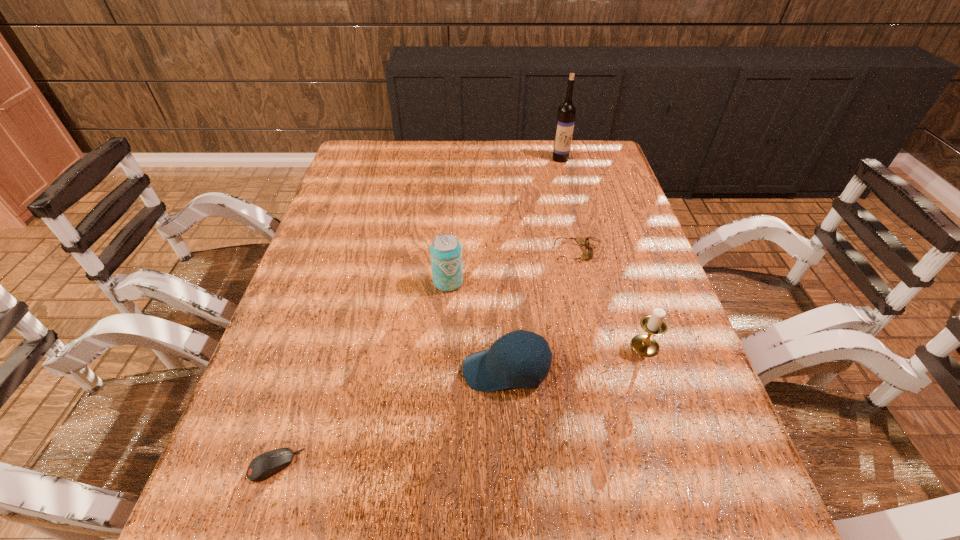
The image size is (960, 540). Find the location of `free space between the spectacles and the fourth nearest object`. free space between the spectacles and the fourth nearest object is located at coordinates (513, 267).

This screenshot has width=960, height=540. What are the coordinates of `free spot between the fourth object from right to left and the candle holder` in the screenshot? It's located at (575, 358).

The height and width of the screenshot is (540, 960). In order to click on object identified as the third closest to the spectacles in this screenshot , I will do `click(501, 367)`.

Locate which object is the second closest to the rightmost object. Please provide its 2D coordinates. Your answer should be formatted as a tuple, i.e. [(x, y)], where the tuple contains the x and y coordinates of a point satisfying the conditions above.

[(581, 241)]

Find the location of `vacant space that satisfies the following two spatial constraints: 1. on the label of the candle holder; 2. on the left side of the farthest object`. vacant space that satisfies the following two spatial constraints: 1. on the label of the candle holder; 2. on the left side of the farthest object is located at coordinates (608, 346).

Identify the location of free region that satisfies the following two spatial constraints: 1. on the back side of the rightmost object; 2. on the front-facing side of the spectacles. point(614,253).

The image size is (960, 540). I want to click on free space that satisfies the following two spatial constraints: 1. on the front-facing side of the fifth nearest object; 2. on the front side of the nearest object, so click(628, 465).

Identify the location of free location that satisfies the following two spatial constraints: 1. on the back side of the candle holder; 2. on the front-facing side of the spectacles. The image size is (960, 540). (614, 253).